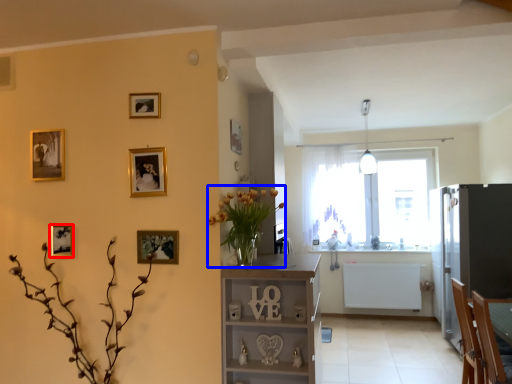
Question: Which of the following is the farthest to the observer, picture frame (highlighted by a red box) or floral arrangement (highlighted by a blue box)?

Choices:
 (A) picture frame
 (B) floral arrangement

Answer: (A)